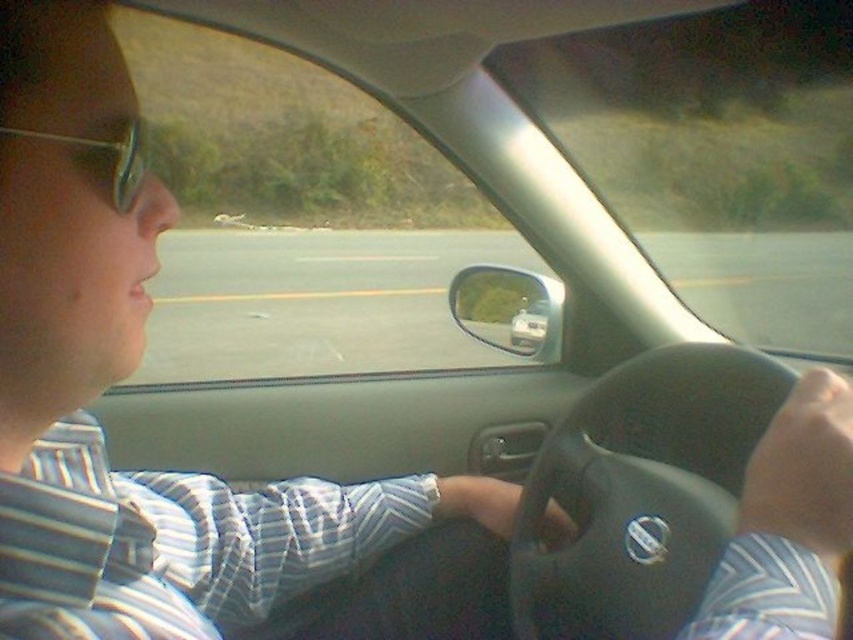
Who is shorter, black leather steering wheel at center or sunglasses at upper left?

With less height is sunglasses at upper left.

Which of these two, black leather steering wheel at center or sunglasses at upper left, stands taller?

With more height is black leather steering wheel at center.

What do you see at coordinates (641, 492) in the screenshot?
I see `black leather steering wheel at center` at bounding box center [641, 492].

Where is `black leather steering wheel at center`? black leather steering wheel at center is located at coordinates (641, 492).

Is black leather steering wheel at center further to the viewer compared to metallic silver car at center?

No, it is not.

Does black leather steering wheel at center have a larger size compared to metallic silver car at center?

Indeed, black leather steering wheel at center has a larger size compared to metallic silver car at center.

Locate an element on the screen. black leather steering wheel at center is located at coordinates (641, 492).

In order to click on black leather steering wheel at center in this screenshot , I will do `click(641, 492)`.

Can you confirm if sunglasses at upper left is positioned to the right of metallic silver car at center?

No, sunglasses at upper left is not to the right of metallic silver car at center.

Find the location of a particular element. This screenshot has width=853, height=640. sunglasses at upper left is located at coordinates (113, 161).